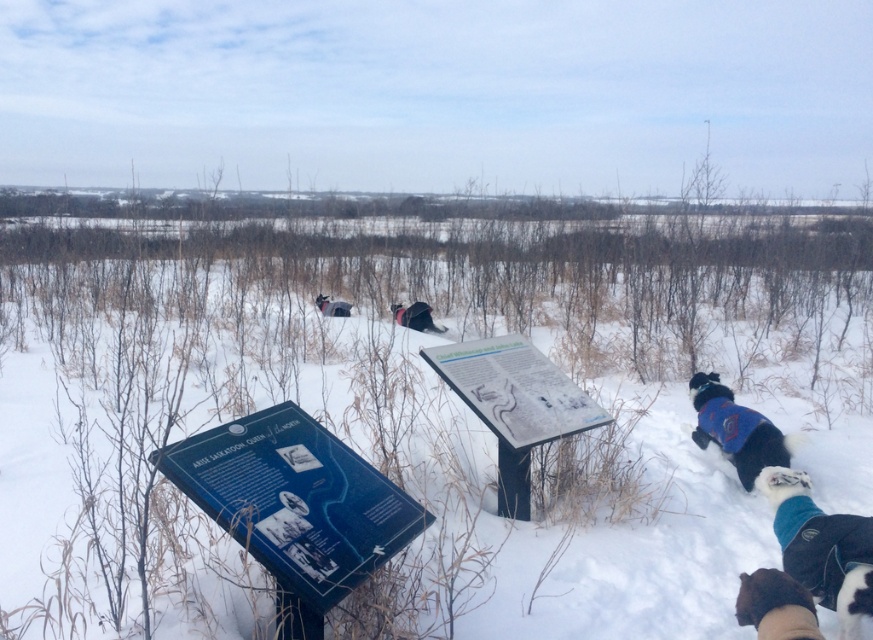
Question: Among these points, which one is farthest from the camera?

Choices:
 (A) (332, 307)
 (B) (236, 561)
 (C) (851, 522)
 (D) (431, 349)

Answer: (A)

Question: Considering the relative positions of white plastic sign at center and blue fleece jacket at lower right in the image provided, where is white plastic sign at center located with respect to blue fleece jacket at lower right?

Choices:
 (A) left
 (B) right

Answer: (A)

Question: Does white fluffy snow at center lie behind blue fleece jacket at center?

Choices:
 (A) yes
 (B) no

Answer: (B)

Question: In this image, where is white fluffy snow at center located relative to blue fleece jacket at center?

Choices:
 (A) left
 (B) right

Answer: (B)

Question: Which of these objects is positioned farthest from the blue fleece jacket at lower right?

Choices:
 (A) black fuzzy dog at center
 (B) brown fur coat at lower right

Answer: (A)

Question: Which of the following is the farthest from the observer?

Choices:
 (A) white fluffy snow at center
 (B) blue fleece jacket at center
 (C) white plastic sign at center

Answer: (B)